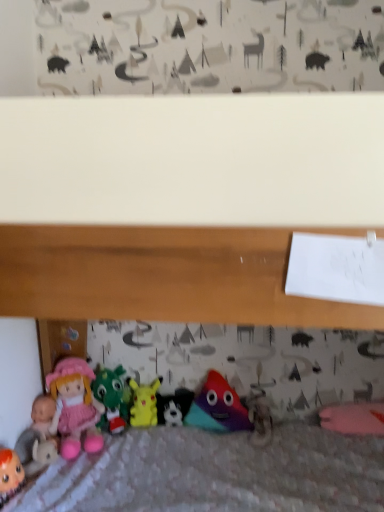
Question: Can we say black plush toy at center, arranged as the fourth toy when viewed from the left, lies outside matte pink fabric doll at lower left?

Choices:
 (A) no
 (B) yes

Answer: (B)

Question: Is matte pink fabric doll at lower left located within black plush toy at center, the 2th toy when ordered from right to left?

Choices:
 (A) no
 (B) yes

Answer: (A)

Question: Could you tell me if black plush toy at center, the 2th toy when ordered from right to left, is turned towards matte pink fabric doll at lower left?

Choices:
 (A) yes
 (B) no

Answer: (B)

Question: Does black plush toy at center, the 2th toy when ordered from right to left, appear on the right side of matte pink fabric doll at lower left?

Choices:
 (A) no
 (B) yes

Answer: (B)

Question: Can you confirm if black plush toy at center, arranged as the fourth toy when viewed from the left, is wider than matte pink fabric doll at lower left?

Choices:
 (A) no
 (B) yes

Answer: (A)

Question: In the image, is matte pink fabric doll at lower left positioned in front of or behind matte pink doll at lower left, the first toy positioned from the left?

Choices:
 (A) front
 (B) behind

Answer: (A)

Question: Considering the relative positions of matte pink fabric doll at lower left and matte pink doll at lower left, the first toy positioned from the left, in the image provided, is matte pink fabric doll at lower left to the left or to the right of matte pink doll at lower left, the first toy positioned from the left,?

Choices:
 (A) right
 (B) left

Answer: (A)

Question: From the image's perspective, is matte pink fabric doll at lower left positioned above or below matte pink doll at lower left, which ranks as the 5th toy in right-to-left order?

Choices:
 (A) above
 (B) below

Answer: (A)

Question: Is matte pink fabric doll at lower left inside or outside of matte pink doll at lower left, which ranks as the 5th toy in right-to-left order?

Choices:
 (A) outside
 (B) inside

Answer: (A)

Question: From a real-world perspective, is velvety green dragon at center, the 2th toy when ordered from left to right, above or below yellow matte pikachu at center, the 3th toy positioned from the left?

Choices:
 (A) below
 (B) above

Answer: (B)

Question: Looking at the image, does velvety green dragon at center, which appears as the fourth toy when viewed from the right, seem bigger or smaller compared to yellow matte pikachu at center, the 3th toy positioned from the left?

Choices:
 (A) small
 (B) big

Answer: (B)

Question: In terms of height, does velvety green dragon at center, which appears as the fourth toy when viewed from the right, look taller or shorter compared to yellow matte pikachu at center, the 3th toy positioned from the left?

Choices:
 (A) tall
 (B) short

Answer: (A)

Question: Is velvety green dragon at center, the 2th toy when ordered from left to right, inside the boundaries of yellow matte pikachu at center, acting as the 3th toy starting from the right, or outside?

Choices:
 (A) inside
 (B) outside

Answer: (B)

Question: From the image's perspective, is velvety green dragon at center, which appears as the fourth toy when viewed from the right, positioned above or below black plush toy at center, arranged as the fourth toy when viewed from the left?

Choices:
 (A) below
 (B) above

Answer: (B)

Question: Considering their positions, is velvety green dragon at center, which appears as the fourth toy when viewed from the right, located in front of or behind black plush toy at center, the 2th toy when ordered from right to left?

Choices:
 (A) behind
 (B) front

Answer: (B)